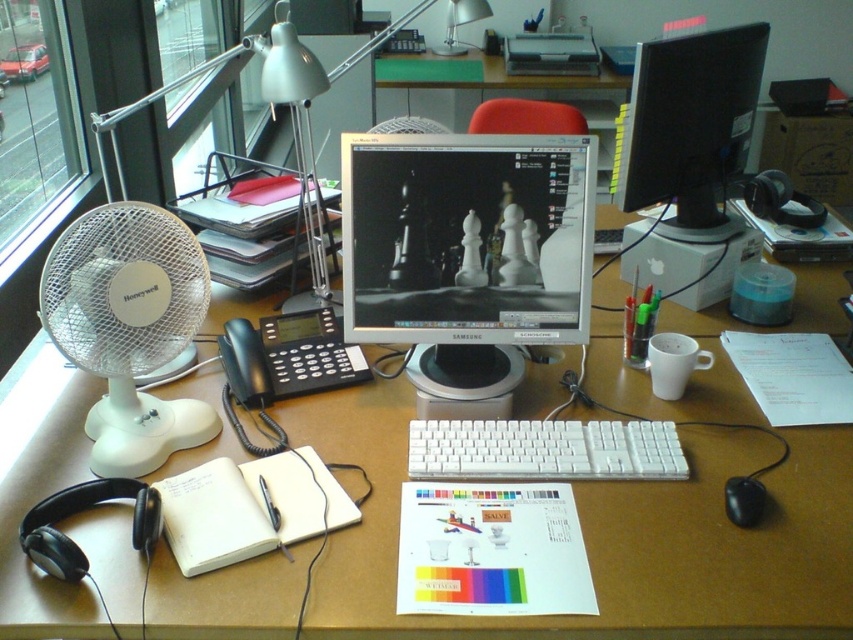
Question: Which point is farther from the camera taking this photo?

Choices:
 (A) (605, 529)
 (B) (90, 273)

Answer: (B)

Question: Considering the relative positions of white plastic fan at left and black glossy monitor at upper right in the image provided, where is white plastic fan at left located with respect to black glossy monitor at upper right?

Choices:
 (A) right
 (B) left

Answer: (B)

Question: Among these points, which one is farthest from the camera?

Choices:
 (A) (361, 136)
 (B) (708, 496)

Answer: (A)

Question: Can you confirm if white plastic desk at center is thinner than white plastic fan at left?

Choices:
 (A) yes
 (B) no

Answer: (B)

Question: Which object appears farthest from the camera in this image?

Choices:
 (A) white plastic keyboard at center
 (B) white plastic desk at center
 (C) white plastic fan at left
 (D) black glossy monitor at upper right

Answer: (D)

Question: Can you confirm if white plastic desk at center is thinner than white plastic keyboard at center?

Choices:
 (A) yes
 (B) no

Answer: (B)